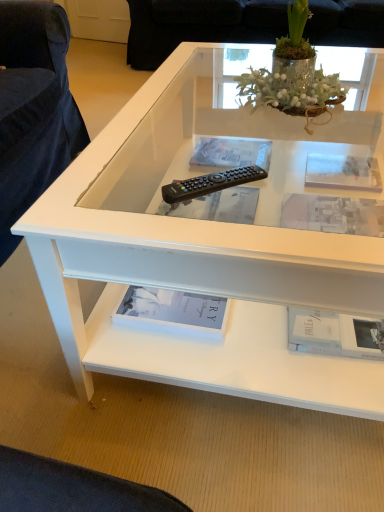
Question: From a real-world perspective, is transparent glass frame at upper center physically above green glass vase at upper center?

Choices:
 (A) no
 (B) yes

Answer: (A)

Question: From a real-world perspective, is transparent glass frame at upper center physically below green glass vase at upper center?

Choices:
 (A) yes
 (B) no

Answer: (A)

Question: Is transparent glass frame at upper center aimed at green glass vase at upper center?

Choices:
 (A) no
 (B) yes

Answer: (A)

Question: Is the surface of transparent glass frame at upper center in direct contact with green glass vase at upper center?

Choices:
 (A) no
 (B) yes

Answer: (A)

Question: Can you confirm if transparent glass frame at upper center is thinner than green glass vase at upper center?

Choices:
 (A) no
 (B) yes

Answer: (B)

Question: Is transparent glass frame at upper center oriented away from green glass vase at upper center?

Choices:
 (A) no
 (B) yes

Answer: (A)

Question: Does clear plastic book at center, marked as the first book in a back-to-front arrangement, lie behind white matte book at lower right, arranged as the 1th book when viewed from the front?

Choices:
 (A) no
 (B) yes

Answer: (B)

Question: Is clear plastic book at center, marked as the first book in a back-to-front arrangement, to the left of white matte book at lower right, arranged as the 1th book when viewed from the front, from the viewer's perspective?

Choices:
 (A) yes
 (B) no

Answer: (A)

Question: Can you confirm if clear plastic book at center, which is counted as the 5th book, starting from the front, is wider than white matte book at lower right, arranged as the 1th book when viewed from the front?

Choices:
 (A) yes
 (B) no

Answer: (A)

Question: Is clear plastic book at center, marked as the first book in a back-to-front arrangement, not inside white matte book at lower right, the 5th book when ordered from back to front?

Choices:
 (A) no
 (B) yes

Answer: (B)

Question: From the image's perspective, is clear plastic book at center, marked as the first book in a back-to-front arrangement, above white matte book at lower right, the 5th book when ordered from back to front?

Choices:
 (A) no
 (B) yes

Answer: (B)

Question: Considering the relative sizes of clear plastic book at center, which is counted as the 5th book, starting from the front, and white matte book at lower right, arranged as the 1th book when viewed from the front, in the image provided, is clear plastic book at center, which is counted as the 5th book, starting from the front, smaller than white matte book at lower right, arranged as the 1th book when viewed from the front,?

Choices:
 (A) yes
 (B) no

Answer: (B)

Question: Is clear plastic book at center, which is counted as the 5th book, starting from the front, not within transparent glass frame at upper center?

Choices:
 (A) no
 (B) yes

Answer: (B)